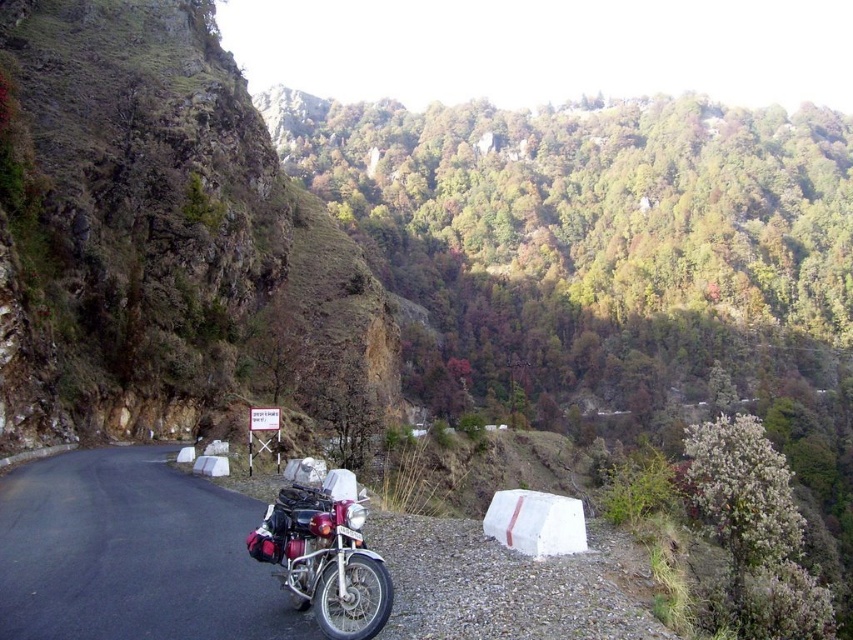
You are a hiker standing on the roadside and want to take a photo of both the metallic motorcycle at center and the shiny chrome motorcycle at center. Which motorcycle should you focus on first to ensure both are in the frame?

You should focus on the metallic motorcycle at center first because it is closer to you than the shiny chrome motorcycle at center, allowing you to adjust the camera to include both in the frame.

You are a hiker planning to walk along the road in the image. You see the metallic motorcycle at center and the shiny chrome motorcycle at center. Which motorcycle is closer to the road edge?

The metallic motorcycle at center has a lesser height compared to the shiny chrome motorcycle at center, so it is closer to the road edge.

You are planning a road trip and need to park your motorcycle. Based on the scene, which object is bigger, the rugged stone cliff at left or the shiny chrome motorcycle at center?

The rugged stone cliff at left is larger in size than the shiny chrome motorcycle at center.